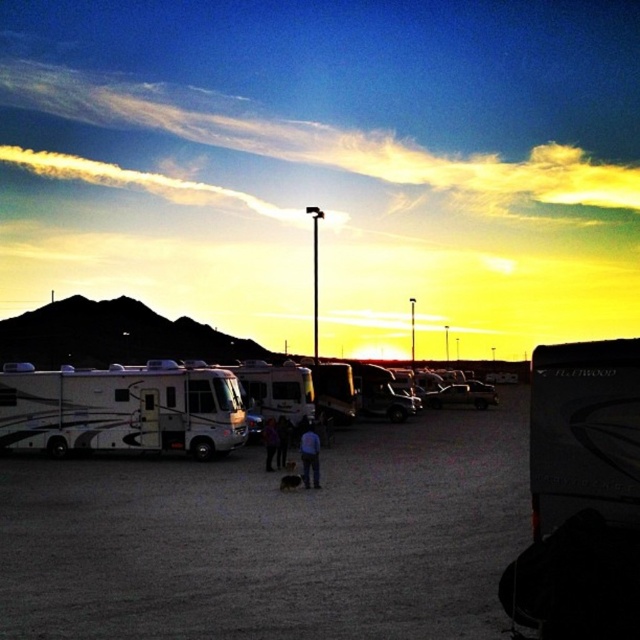
Question: Is white glossy rv at center wider than blue jeans at center?

Choices:
 (A) yes
 (B) no

Answer: (A)

Question: Can you confirm if white glossy rv at left is wider than white glossy rv at center?

Choices:
 (A) no
 (B) yes

Answer: (B)

Question: Which object appears farthest from the camera in this image?

Choices:
 (A) white glossy rv at left
 (B) blue jeans at center
 (C) white glossy rv at center

Answer: (C)

Question: Among these objects, which one is farthest from the camera?

Choices:
 (A) white glossy rv at left
 (B) white glossy recreational vehicle at left
 (C) metallic silver car at center

Answer: (C)

Question: Considering the real-world distances, which object is closest to the white glossy rv at left?

Choices:
 (A) metallic silver car at center
 (B) dark blue jeans at center
 (C) blue jeans at center

Answer: (C)

Question: Does white glossy rv at center come in front of blue jeans at center?

Choices:
 (A) no
 (B) yes

Answer: (A)